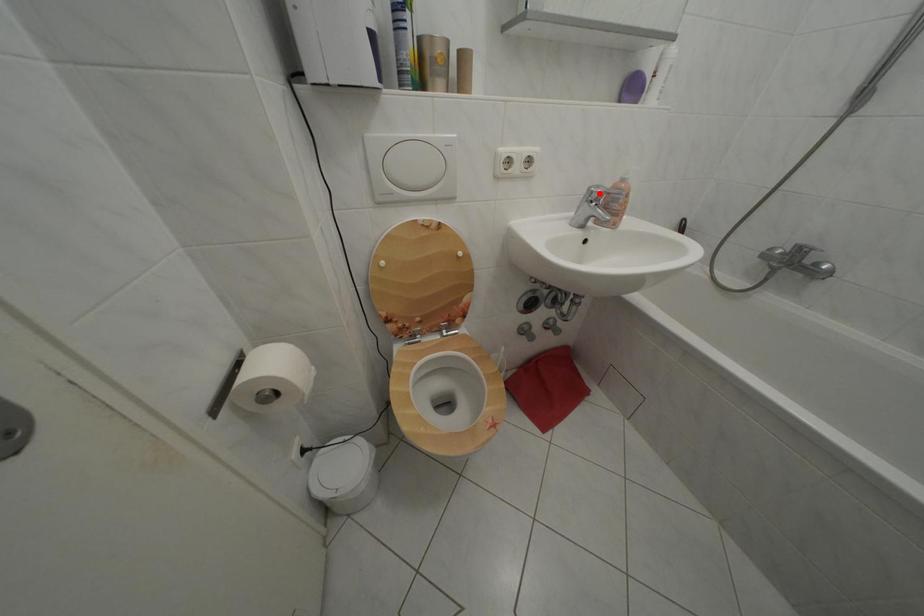
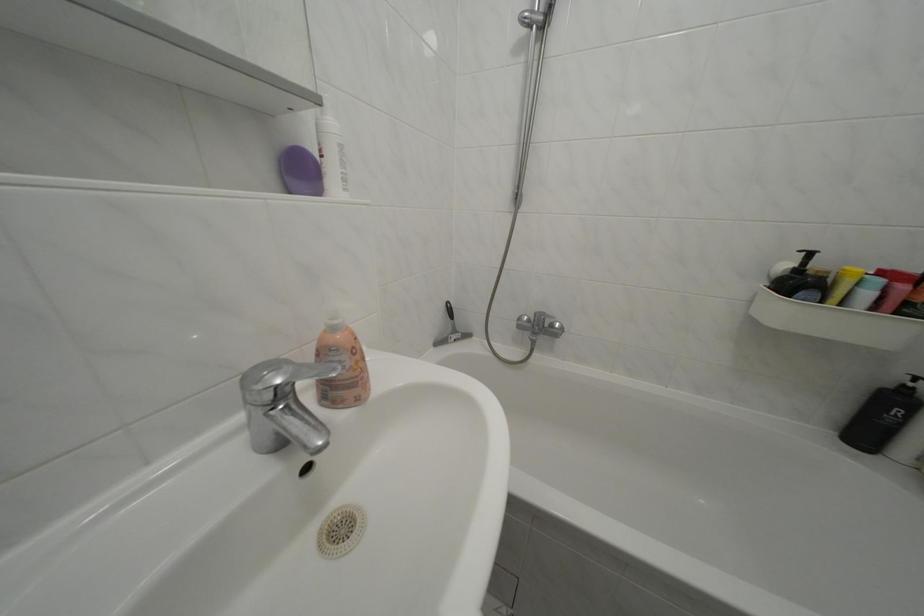
The point at the highlighted location is marked in the first image. Where is the corresponding point in the second image?

(252, 384)